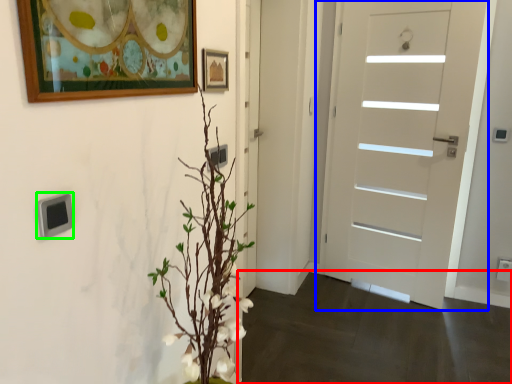
Question: Which object is positioned farthest from corridor (highlighted by a red box)? Select from door (highlighted by a blue box) and light switch (highlighted by a green box).

Choices:
 (A) door
 (B) light switch

Answer: (B)